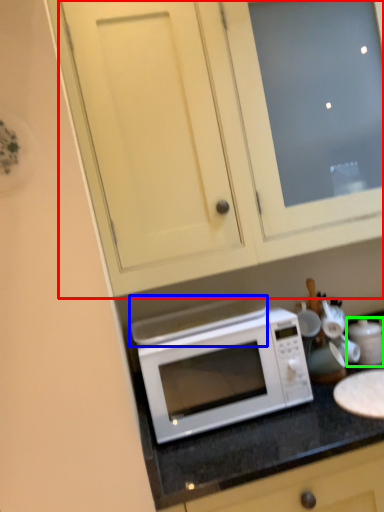
Question: Which is farther away from cabinetry (highlighted by a red box)? exhaust hood (highlighted by a blue box) or appliance (highlighted by a green box)?

Choices:
 (A) exhaust hood
 (B) appliance

Answer: (B)